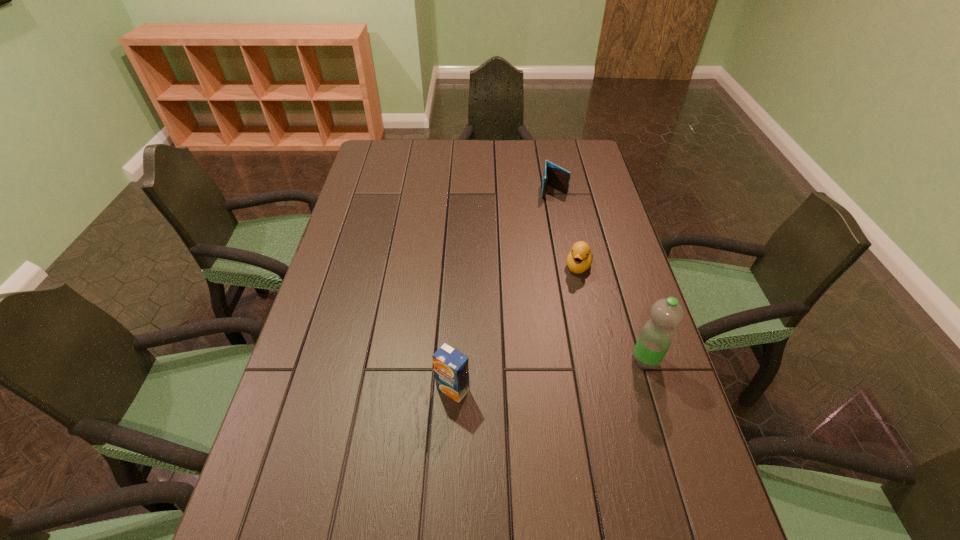
Identify the location of vacant region located 0.130m on the exterior surface of the farthest object. 554,222.

The image size is (960, 540). I want to click on free space located 0.070m on the face of the third nearest object, so tap(570, 294).

The height and width of the screenshot is (540, 960). In order to click on free space located on the face of the third nearest object in this screenshot , I will do `click(569, 297)`.

The height and width of the screenshot is (540, 960). I want to click on vacant space located on the face of the third nearest object, so click(x=550, y=352).

The height and width of the screenshot is (540, 960). I want to click on water bottle that is positioned at the right edge, so click(x=656, y=336).

The width and height of the screenshot is (960, 540). What are the coordinates of `wallet that is at the right edge` in the screenshot? It's located at (558, 178).

Locate an element on the screen. duckling situated at the right edge is located at coordinates (579, 259).

Where is `free space at the far edge`? free space at the far edge is located at coordinates (544, 160).

This screenshot has height=540, width=960. Identify the location of vacant space at the near edge of the desktop. (528, 480).

This screenshot has height=540, width=960. Find the location of `vacant region at the left edge`. vacant region at the left edge is located at coordinates (372, 247).